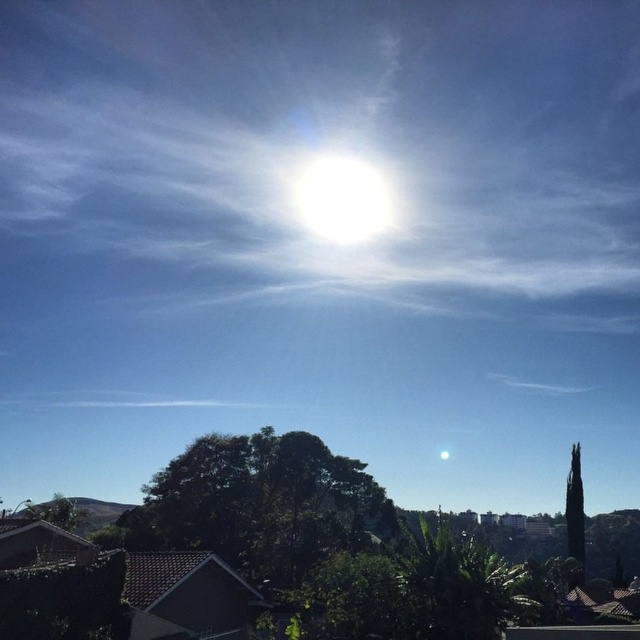
Question: Is the position of green leafy tree at center more distant than that of white glossy sun at center?

Choices:
 (A) yes
 (B) no

Answer: (B)

Question: Can you confirm if green leafy tree at center is smaller than white glossy sun at center?

Choices:
 (A) no
 (B) yes

Answer: (B)

Question: Which point is farther from the camera taking this photo?

Choices:
 (A) (340, 186)
 (B) (278, 573)

Answer: (A)

Question: Observing the image, what is the correct spatial positioning of green leafy tree at center in reference to white glossy sun at center?

Choices:
 (A) above
 (B) below

Answer: (B)

Question: Among these objects, which one is nearest to the camera?

Choices:
 (A) green leafy tree at center
 (B) white glossy sun at center

Answer: (A)